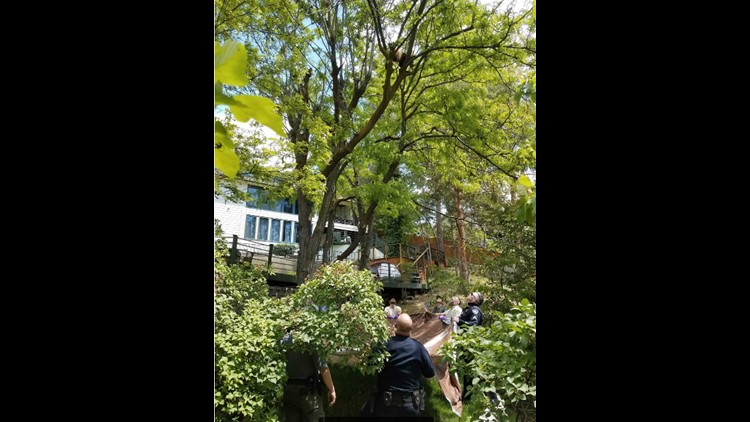
I want to click on window, so click(272, 201), click(250, 228), click(264, 231), click(274, 235), click(288, 236), click(298, 239).